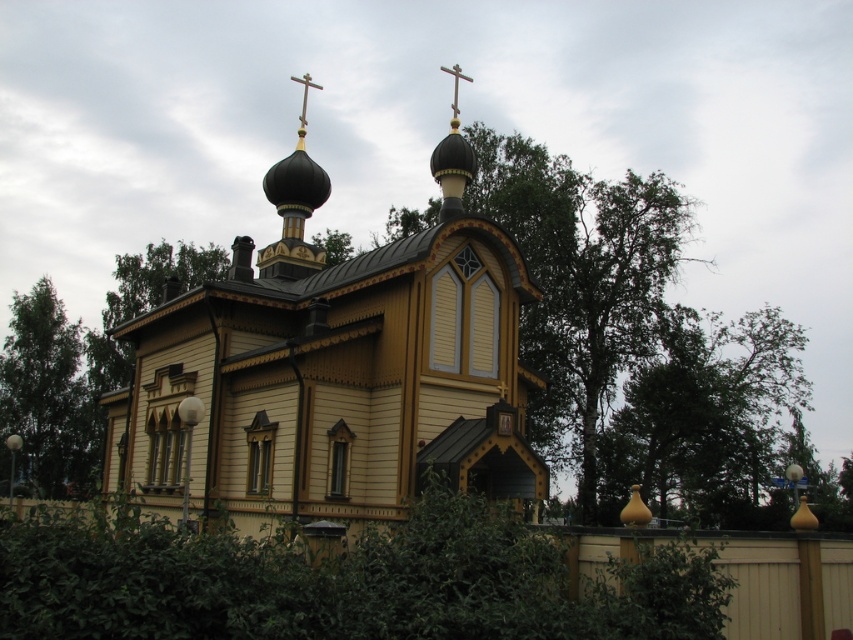
Question: Considering the real-world distances, which object is farthest from the green leafy tree at left?

Choices:
 (A) black wooden dome at center
 (B) green leafy tree at center
 (C) wooden church at center
 (D) metallic gold cross at upper center

Answer: (B)

Question: Estimate the real-world distances between objects in this image. Which object is farther from the white wooden cross at upper center?

Choices:
 (A) green leafy tree at center
 (B) wooden church at center
 (C) green leafy tree at left

Answer: (C)

Question: Which object appears closest to the camera in this image?

Choices:
 (A) black wooden dome at center
 (B) white wooden cross at upper center

Answer: (B)

Question: Is green leafy tree at center positioned behind white wooden cross at upper center?

Choices:
 (A) yes
 (B) no

Answer: (A)

Question: Is green leafy tree at center thinner than green leafy tree at left?

Choices:
 (A) no
 (B) yes

Answer: (A)

Question: From the image, what is the correct spatial relationship of green leafy tree at center in relation to black wooden dome at center?

Choices:
 (A) right
 (B) left

Answer: (A)